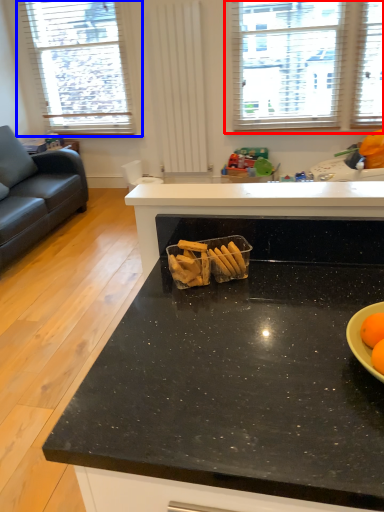
Question: Which object is closer to the camera taking this photo, window (highlighted by a red box) or window (highlighted by a blue box)?

Choices:
 (A) window
 (B) window

Answer: (A)